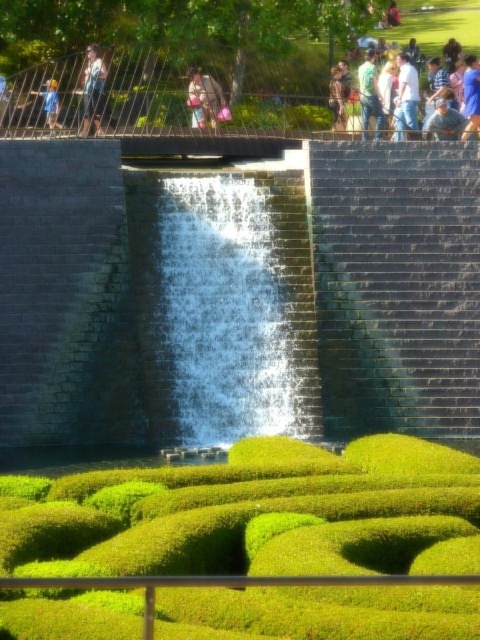
You are standing at the base of the waterfall and want to take a photo of the point at coordinates point (225, 268). If your camera has a maximum focus range of 50 meters, will it be able to focus on that point?

The distance of point (225, 268) from viewer is 48.28 meters, which is within the camera maximum focus range of 50 meters. Therefore, the camera can focus on that point.

You are standing in front of the waterfall and want to place two decorative stones at the coordinates point (266, 406) and point (219, 97). Which stone will be closer to your current position?

Point (266, 406) is in front of point (219, 97), so the stone placed at point (266, 406) will be closer to your current position.

You are a landscape architect designing a new garden. You need to place a decorative statue between the green leafy hedge at center and the light brown hair at upper center. Based on their positions, where should the statue be placed?

The statue should be placed between the green leafy hedge at center and the light brown hair at upper center. Since the green leafy hedge at center is below the light brown hair at upper center, the statue should be positioned above the hedge but below the hair to maintain alignment with their vertical arrangement.